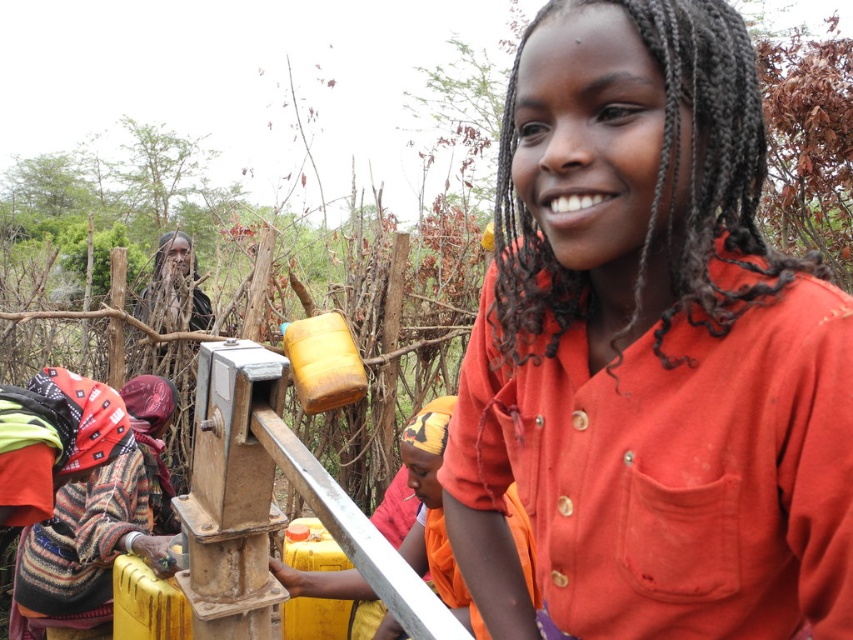
In the scene shown: You are standing in front of the water pump at the rural station. There are two points marked in the scene. The first point is at coordinates point (643,444) and the second is at point (167,512). If you were to walk towards both points, which one would you reach first?

Point (643,444) is closer to the camera than point (167,512), so you would reach point (643,444) first.

You are a painter who wants to paint the scene. You have a limited amount of orange paint. Which object should you use less orange paint for, the orange cotton shirt at center or the striped woolen sweater at lower left?

The orange cotton shirt at center occupies less space than the striped woolen sweater at lower left, so you should use less orange paint for the orange cotton shirt at center.